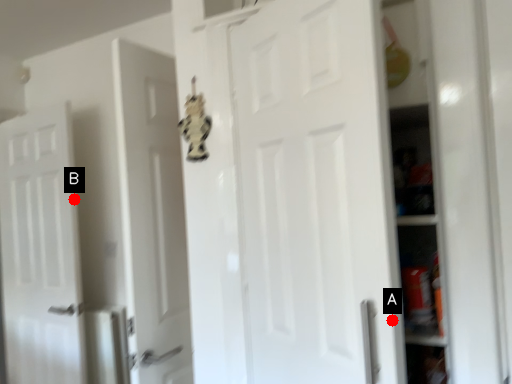
Question: Two points are circled on the image, labeled by A and B beside each circle. Which point is closer to the camera?

Choices:
 (A) A is closer
 (B) B is closer

Answer: (A)